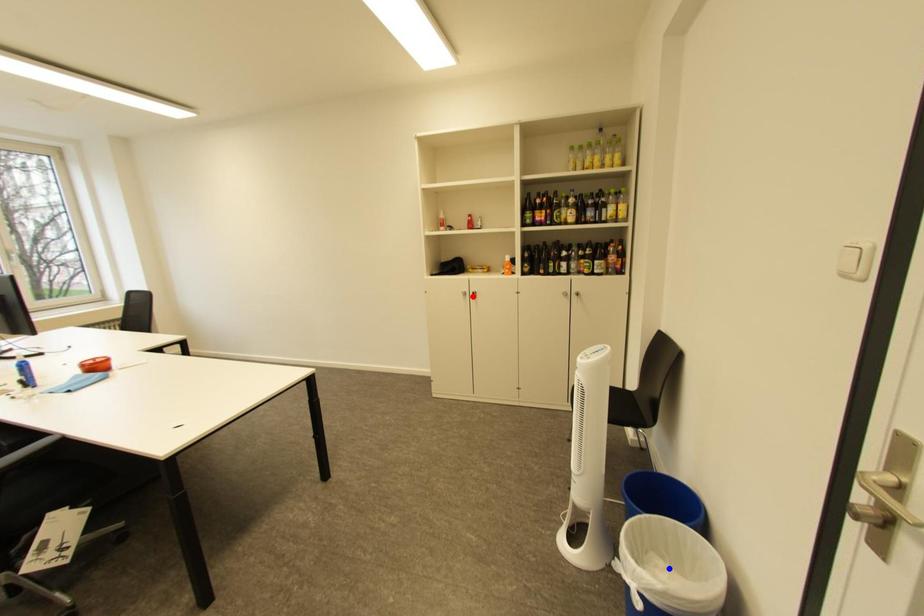
Question: In the image, two points are highlighted. Which point is nearer to the camera? Reply with the corresponding letter.

Choices:
 (A) blue point
 (B) red point

Answer: (A)